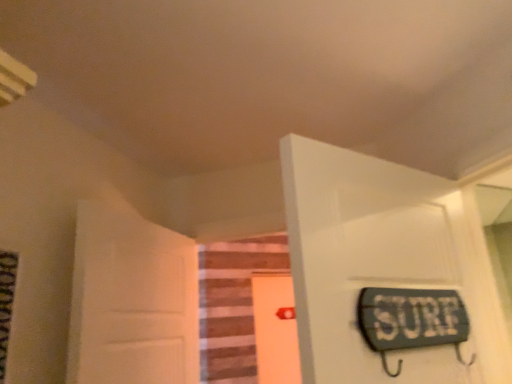
Question: From a real-world perspective, is wooden stairs at center physically located above or below orange matte door at center, the 3th door viewed from the front?

Choices:
 (A) below
 (B) above

Answer: (B)

Question: Would you say wooden stairs at center is inside or outside orange matte door at center, the 3th door viewed from the front?

Choices:
 (A) outside
 (B) inside

Answer: (A)

Question: Estimate the real-world distances between objects in this image. Which object is closer to the orange matte door at center, arranged as the 2th door when viewed from the left?

Choices:
 (A) wooden stairs at center
 (B) white matte door at left, the second door viewed from the back
 (C) white glossy door at upper right, which is counted as the 1th door, starting from the front

Answer: (A)

Question: Which is farther from the white matte door at left, the 2th door viewed from the front?

Choices:
 (A) white glossy door at upper right, which is counted as the 1th door, starting from the front
 (B) wooden stairs at center
 (C) orange matte door at center, the 3th door viewed from the front

Answer: (C)